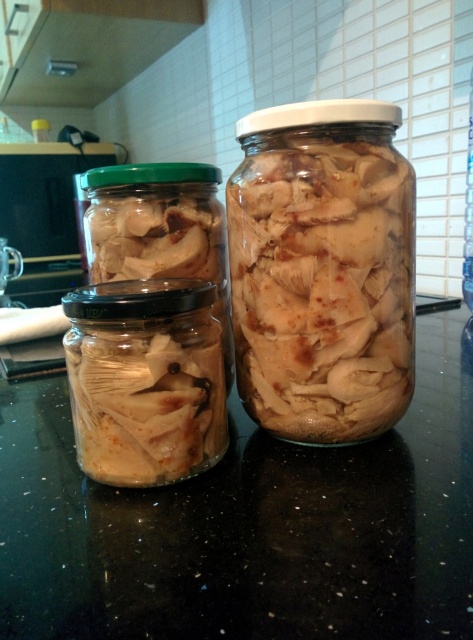
Does transparent glass jars at center appear on the right side of translucent glass mushrooms at center?

Incorrect, transparent glass jars at center is not on the right side of translucent glass mushrooms at center.

Is point (122, 532) positioned before point (253, 301)?

Yes.

Between point (460, 442) and point (261, 244), which one is positioned behind?

Point (460, 442)

This screenshot has width=473, height=640. What are the coordinates of `transparent glass jars at center` in the screenshot? It's located at (247, 525).

Does translucent glass jar at center have a larger size compared to clear glass bottle at center?

No, translucent glass jar at center is not bigger than clear glass bottle at center.

Between translucent glass jar at center and clear glass bottle at center, which one has less height?

translucent glass jar at center

Who is more forward, (166, 346) or (470, 104)?

Positioned in front is point (166, 346).

At what (x,y) coordinates should I click in order to perform the action: click on translucent glass jar at center. Please return your answer as a coordinate pair (x, y). The image size is (473, 640). Looking at the image, I should click on (146, 380).

Is translucent glass mushrooms at center smaller than clear glass bottle at center?

Correct, translucent glass mushrooms at center occupies less space than clear glass bottle at center.

What do you see at coordinates (323, 282) in the screenshot? I see `translucent glass mushrooms at center` at bounding box center [323, 282].

Where is `translucent glass mushrooms at center`? translucent glass mushrooms at center is located at coordinates (323, 282).